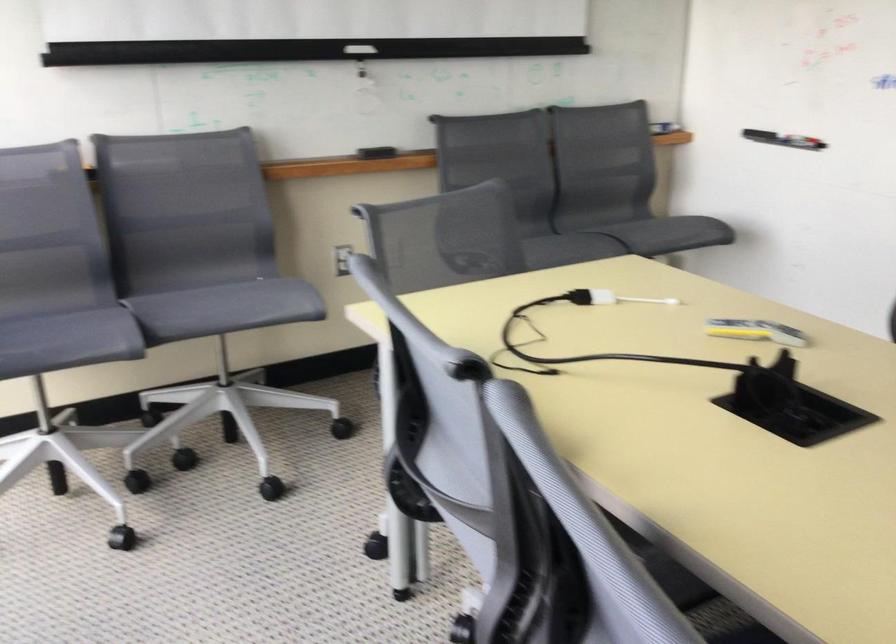
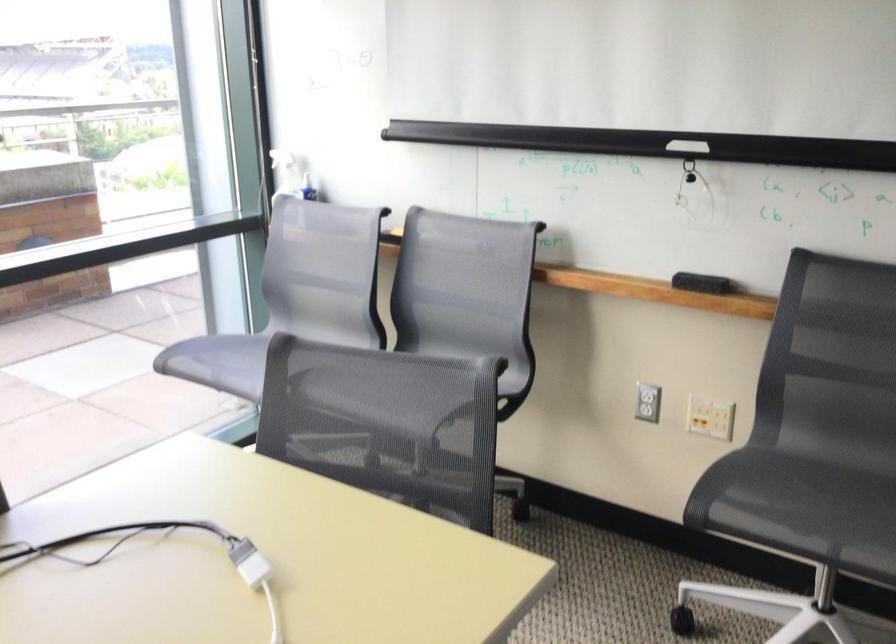
Question: I am providing you with two images of the same scene from different viewpoints. After the viewpoint changes to image2, which objects are now occluded?

Choices:
 (A) white spray bottle
 (B) blue handle knife
 (C) chair sitting surface
 (D) white cable adapter

Answer: (C)